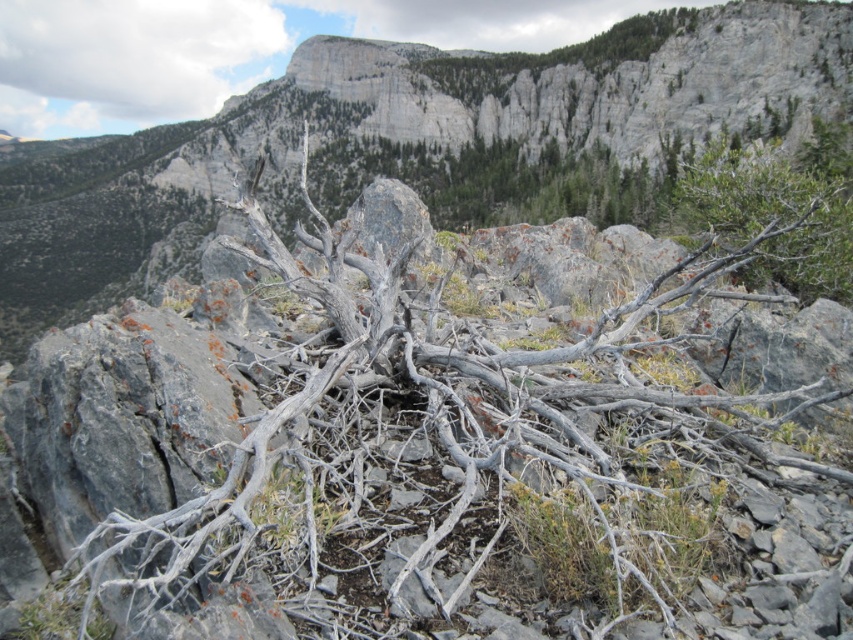
Question: Can you confirm if green leafy shrub at upper right is wider than gray rocky cliff at upper center?

Choices:
 (A) yes
 (B) no

Answer: (B)

Question: Estimate the real-world distances between objects in this image. Which object is closer to the gray rocky cliff at upper center?

Choices:
 (A) gray rock at center
 (B) green leafy shrub at upper right

Answer: (A)

Question: Is gray rock at center to the right of gray rocky cliff at upper center from the viewer's perspective?

Choices:
 (A) no
 (B) yes

Answer: (A)

Question: Is gray rock at center to the left of gray rocky cliff at upper center from the viewer's perspective?

Choices:
 (A) no
 (B) yes

Answer: (B)

Question: Which of the following is the closest to the observer?

Choices:
 (A) gray rock at center
 (B) gray rocky cliff at upper center

Answer: (A)

Question: Which point is farther to the camera?

Choices:
 (A) pyautogui.click(x=434, y=81)
 (B) pyautogui.click(x=755, y=228)

Answer: (A)